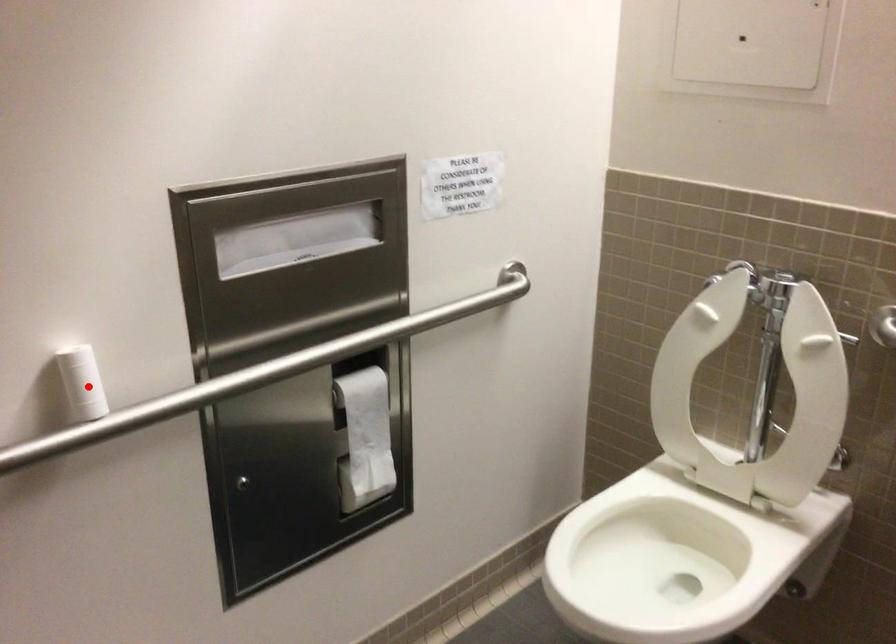
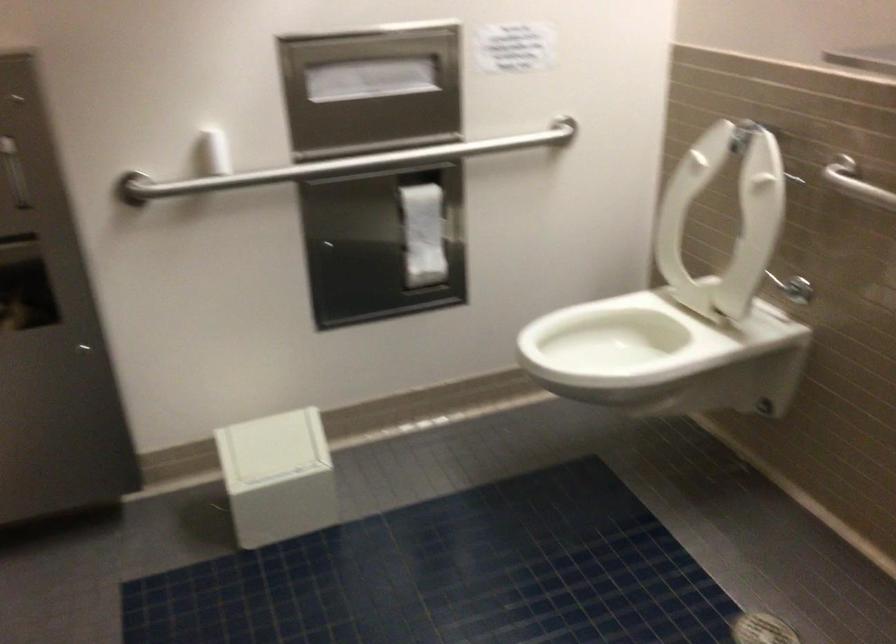
Find the pixel in the second image that matches the highlighted location in the first image.

(213, 152)